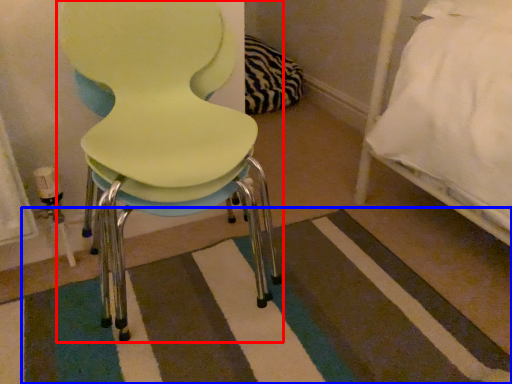
Question: Which point is closer to the camera, chair (highlighted by a red box) or mat (highlighted by a blue box)?

Choices:
 (A) chair
 (B) mat

Answer: (A)